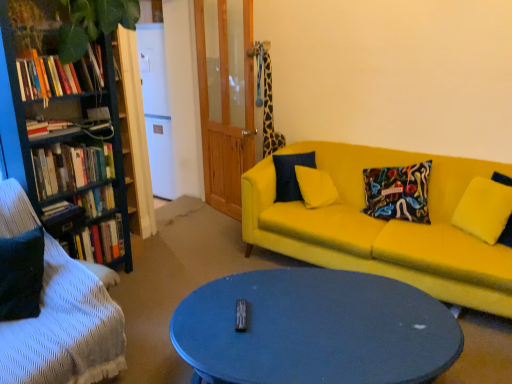
Find the location of a particular element. This screenshot has height=384, width=512. free point above matte blue coffee table at center (from a real-world perspective) is located at coordinates (318, 314).